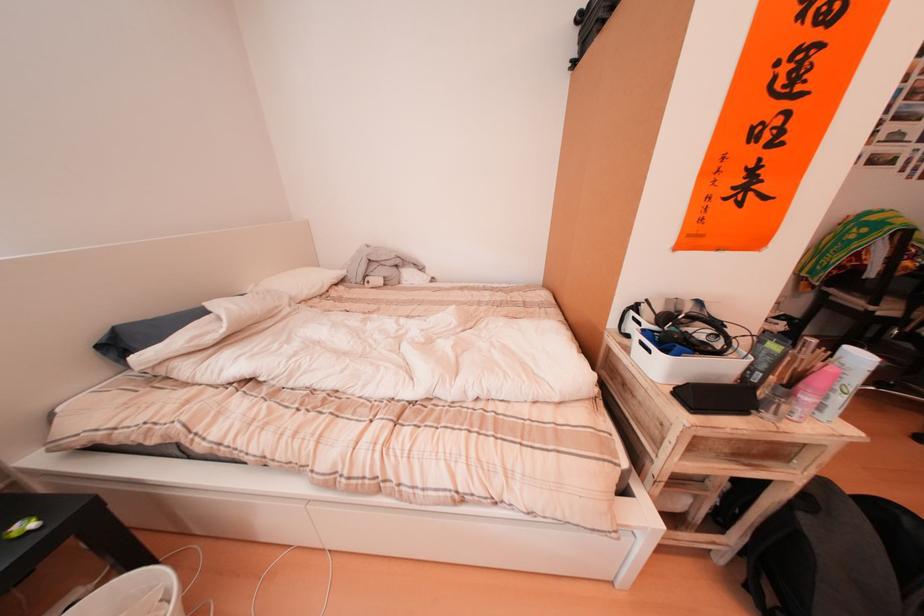
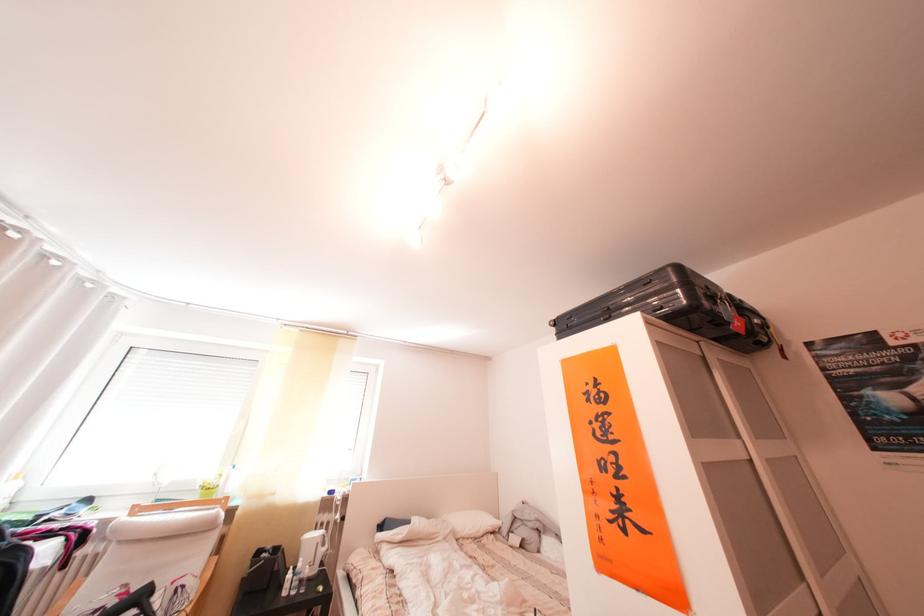
In the second image, find the point that corresponds to point (721, 204) in the first image.

(610, 522)